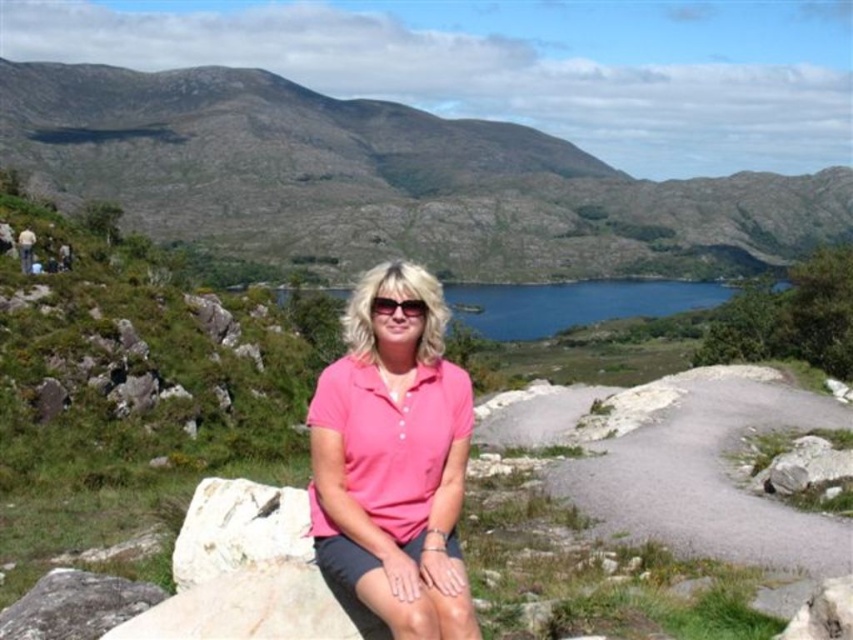
Between pink cotton shirt at center and pink cotton polo shirt at center, which one has more height?

With more height is pink cotton shirt at center.

Does pink cotton shirt at center lie in front of pink cotton polo shirt at center?

Yes, it is.

Who is more distant from viewer, [440,352] or [321,372]?

The point [321,372] is behind.

Locate an element on the screen. The image size is (853, 640). pink cotton shirt at center is located at coordinates (393, 460).

Is pink cotton shirt at center behind blue glassy water at center?

No.

Can you confirm if pink cotton shirt at center is thinner than blue glassy water at center?

Indeed, pink cotton shirt at center has a lesser width compared to blue glassy water at center.

This screenshot has height=640, width=853. I want to click on pink cotton shirt at center, so click(x=393, y=460).

Between pink cotton shirt at center and gray rough rock at lower left, which one has more height?

With more height is pink cotton shirt at center.

Who is more distant from viewer, (450, 544) or (36, 600)?

Point (36, 600)

Find the location of a particular element. pink cotton shirt at center is located at coordinates (393, 460).